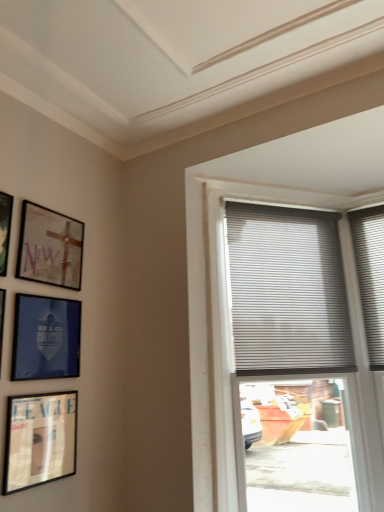
Question: Is gray pleated blinds at upper right further to camera compared to matte black picture frame at upper left, the 1th picture frame from the top?

Choices:
 (A) no
 (B) yes

Answer: (B)

Question: Is gray pleated blinds at upper right positioned beyond the bounds of matte black picture frame at upper left, which appears as the fifth picture frame when ordered from the bottom?

Choices:
 (A) no
 (B) yes

Answer: (B)

Question: Considering the relative sizes of gray pleated blinds at upper right and matte black picture frame at upper left, the 1th picture frame from the top, in the image provided, is gray pleated blinds at upper right thinner than matte black picture frame at upper left, the 1th picture frame from the top,?

Choices:
 (A) no
 (B) yes

Answer: (A)

Question: Can you confirm if gray pleated blinds at upper right is smaller than matte black picture frame at upper left, the 1th picture frame from the top?

Choices:
 (A) no
 (B) yes

Answer: (A)

Question: Is gray pleated blinds at upper right closer to camera compared to matte black picture frame at upper left, the 1th picture frame from the top?

Choices:
 (A) no
 (B) yes

Answer: (A)

Question: Could you tell me if gray pleated blinds at upper right is facing matte black picture frame at upper left, the 1th picture frame from the top?

Choices:
 (A) no
 (B) yes

Answer: (A)

Question: Can you confirm if matte black picture frame at upper left, the 1th picture frame from the top, is shorter than blue glossy picture frame at upper left, which is counted as the second picture frame, starting from the bottom?

Choices:
 (A) yes
 (B) no

Answer: (B)

Question: Is matte black picture frame at upper left, which appears as the fifth picture frame when ordered from the bottom, positioned with its back to blue glossy picture frame at upper left, which is counted as the second picture frame, starting from the bottom?

Choices:
 (A) yes
 (B) no

Answer: (B)

Question: From the image's perspective, would you say matte black picture frame at upper left, which appears as the fifth picture frame when ordered from the bottom, is shown under blue glossy picture frame at upper left, which is counted as the second picture frame, starting from the bottom?

Choices:
 (A) no
 (B) yes

Answer: (A)

Question: Is matte black picture frame at upper left, the 1th picture frame from the top, not close to blue glossy picture frame at upper left, the fourth picture frame in the top-to-bottom sequence?

Choices:
 (A) no
 (B) yes

Answer: (A)

Question: From a real-world perspective, is matte black picture frame at upper left, the 1th picture frame from the top, below blue glossy picture frame at upper left, which is counted as the second picture frame, starting from the bottom?

Choices:
 (A) no
 (B) yes

Answer: (A)

Question: Is matte black picture frame at upper left, the 1th picture frame from the top, completely or partially outside of blue glossy picture frame at upper left, which is counted as the second picture frame, starting from the bottom?

Choices:
 (A) no
 (B) yes

Answer: (B)

Question: From a real-world perspective, does matte black picture frame at left, which appears as the 3th picture frame when ordered from the bottom, stand above gray pleated blinds at upper right?

Choices:
 (A) yes
 (B) no

Answer: (B)